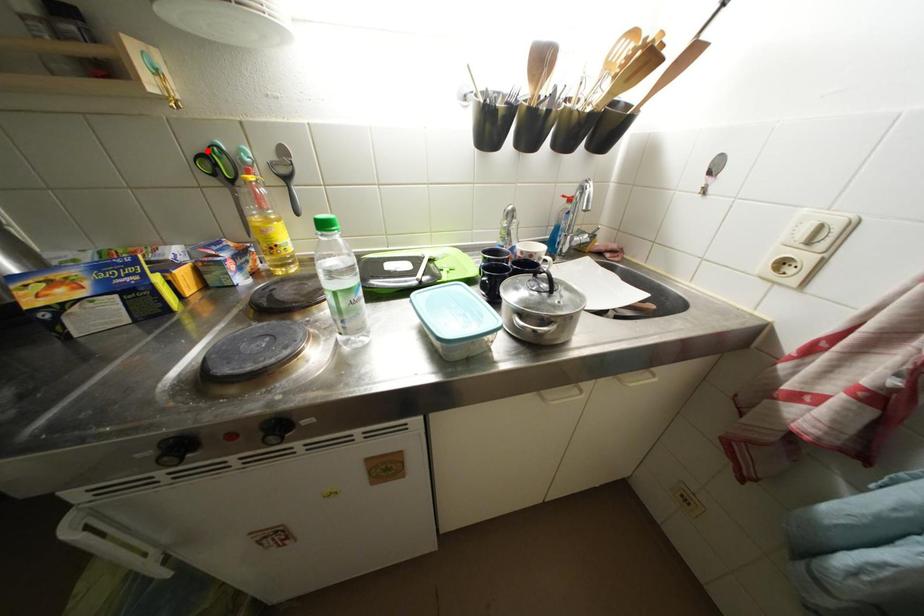
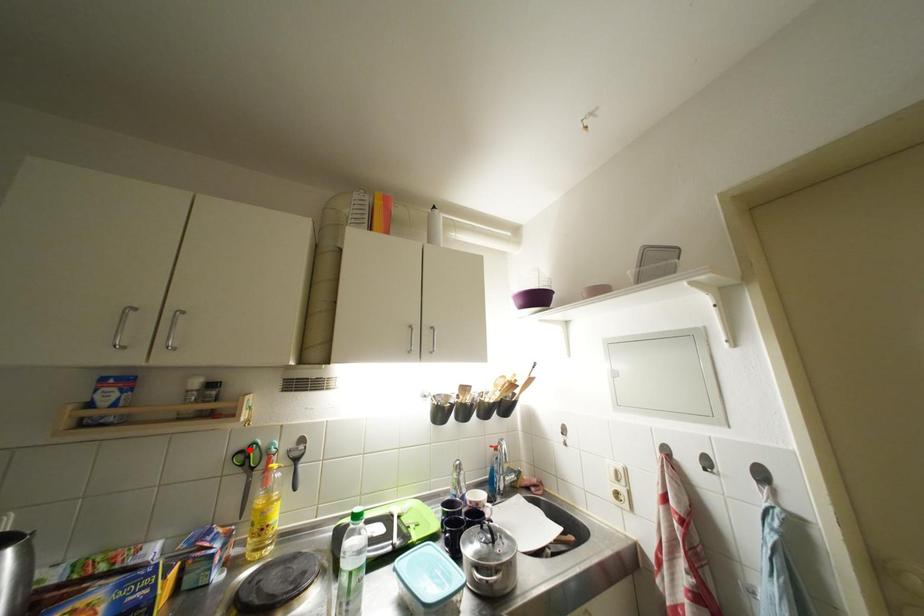
I am providing you with two images of the same scene from different viewpoints. A red point is marked on the first image and another point is marked on the second image. Is the red point in image1 aligned with the point shown in image2?

Yes